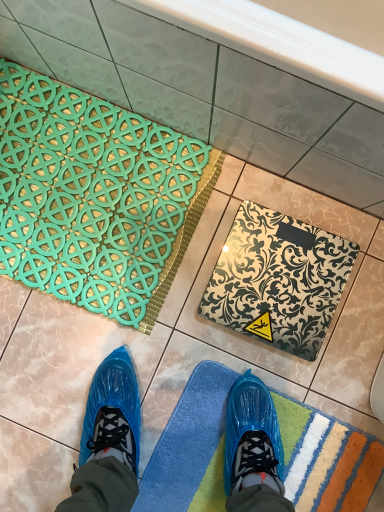
Question: Does teal rubber bath mat at upper left, which is counted as the 3th bath mat, starting from the bottom, lie in front of blue textured bath mat at lower center, positioned as the 3th bath mat in top-to-bottom order?

Choices:
 (A) no
 (B) yes

Answer: (A)

Question: Is teal rubber bath mat at upper left, which is counted as the 3th bath mat, starting from the bottom, thinner than blue textured bath mat at lower center, which is the first bath mat from bottom to top?

Choices:
 (A) no
 (B) yes

Answer: (B)

Question: Is teal rubber bath mat at upper left, which is counted as the 3th bath mat, starting from the bottom, looking in the opposite direction of blue textured bath mat at lower center, positioned as the 3th bath mat in top-to-bottom order?

Choices:
 (A) yes
 (B) no

Answer: (B)

Question: From a real-world perspective, is teal rubber bath mat at upper left, which is counted as the 3th bath mat, starting from the bottom, located beneath blue textured bath mat at lower center, which is the first bath mat from bottom to top?

Choices:
 (A) yes
 (B) no

Answer: (B)

Question: Is teal rubber bath mat at upper left, the 1th bath mat from the top, bigger than blue textured bath mat at lower center, which is the first bath mat from bottom to top?

Choices:
 (A) yes
 (B) no

Answer: (A)

Question: Is teal rubber bath mat at upper left, the 1th bath mat from the top, taller than blue textured bath mat at lower center, which is the first bath mat from bottom to top?

Choices:
 (A) yes
 (B) no

Answer: (A)

Question: Can you confirm if metallic silver scale at center, the 2th bath mat from the bottom, is taller than blue textured bath mat at lower center, which is the first bath mat from bottom to top?

Choices:
 (A) no
 (B) yes

Answer: (B)

Question: From the image's perspective, is metallic silver scale at center, the 2th bath mat positioned from the top, on blue textured bath mat at lower center, which is the first bath mat from bottom to top?

Choices:
 (A) no
 (B) yes

Answer: (B)

Question: Is metallic silver scale at center, the 2th bath mat from the bottom, not within blue textured bath mat at lower center, which is the first bath mat from bottom to top?

Choices:
 (A) yes
 (B) no

Answer: (A)

Question: Can you confirm if metallic silver scale at center, the 2th bath mat from the bottom, is positioned to the right of blue textured bath mat at lower center, positioned as the 3th bath mat in top-to-bottom order?

Choices:
 (A) yes
 (B) no

Answer: (A)

Question: From a real-world perspective, is metallic silver scale at center, the 2th bath mat from the bottom, beneath blue textured bath mat at lower center, which is the first bath mat from bottom to top?

Choices:
 (A) no
 (B) yes

Answer: (A)

Question: Would you say metallic silver scale at center, the 2th bath mat from the bottom, contains blue textured bath mat at lower center, which is the first bath mat from bottom to top?

Choices:
 (A) no
 (B) yes

Answer: (A)

Question: Can you confirm if blue textured bath mat at lower center, positioned as the 3th bath mat in top-to-bottom order, is shorter than teal rubber bath mat at upper left, which is counted as the 3th bath mat, starting from the bottom?

Choices:
 (A) yes
 (B) no

Answer: (A)